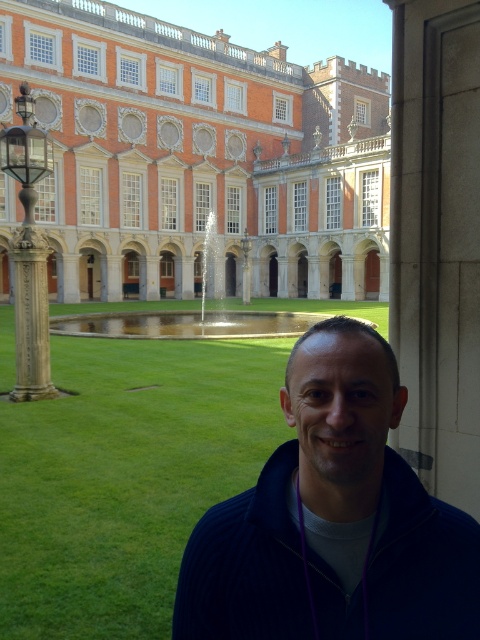
You are a photographer trying to capture a photo of the fountain in the background. You notice the green grass at lower center and the dark blue sweater at lower right in your frame. Which object should you adjust your camera angle to focus on if you want to highlight the fountain?

The green grass at lower center is above the dark blue sweater at lower right. To highlight the fountain, focus on the green grass at lower center since it is closer to the fountain in the background.

You are a photographer trying to capture a wide shot of the scene. Since the green grass at lower center and the dark blue sweater at lower right are both in the frame, which one will occupy more of the photo?

The green grass at lower center will occupy more of the photo because it is larger in size than the dark blue sweater at lower right.

You are taking a photo of the scene and want to focus on both point [120,211] and point [263,509]. Which point is closer to the camera?

Point [120,211] is closer to the camera than point [263,509].